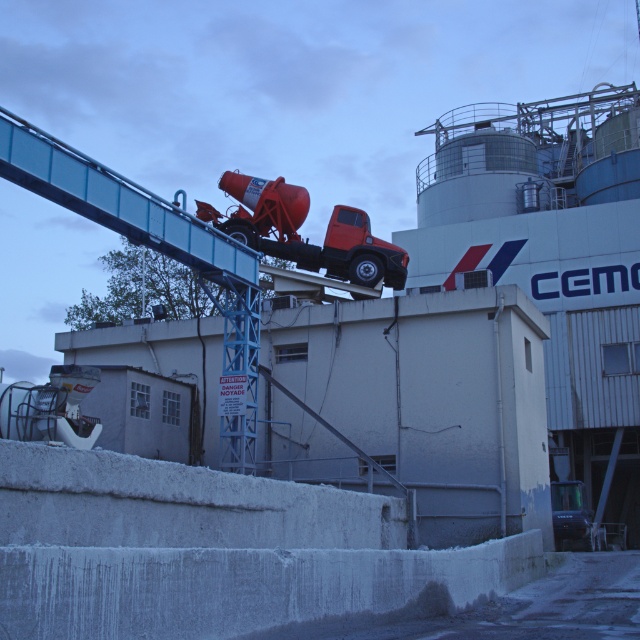
Is matte orange concrete mixer at upper center above metallic gray truck at lower right?

Yes, matte orange concrete mixer at upper center is above metallic gray truck at lower right.

Does point (278, 230) lie behind point (570, 490)?

No.

Describe the element at coordinates (305, 237) in the screenshot. I see `matte orange concrete mixer at upper center` at that location.

Where is `matte orange concrete mixer at upper center`? The image size is (640, 640). matte orange concrete mixer at upper center is located at coordinates (305, 237).